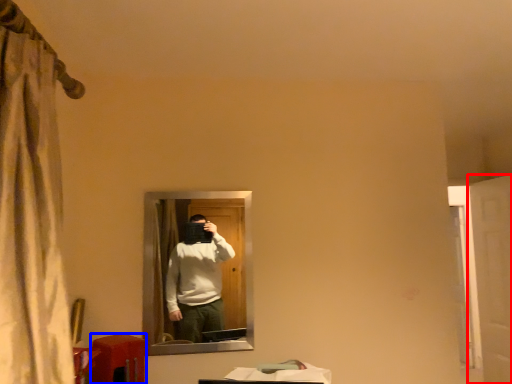
Question: Which object is closer to the camera taking this photo, screen door (highlighted by a red box) or table (highlighted by a blue box)?

Choices:
 (A) screen door
 (B) table

Answer: (B)